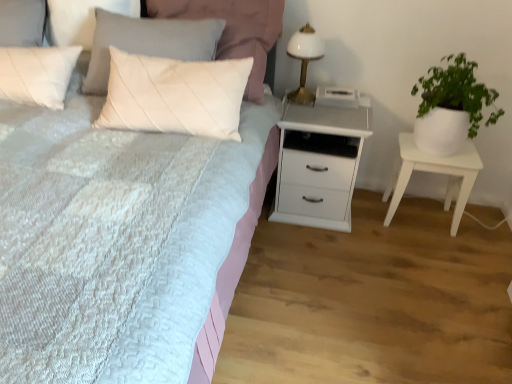
This screenshot has height=384, width=512. I want to click on free space in front of white glossy table lamp at upper right, so click(x=309, y=111).